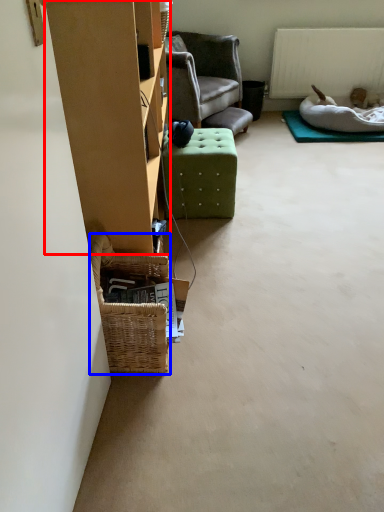
Question: Among these objects, which one is farthest to the camera, furniture (highlighted by a red box) or picnic basket (highlighted by a blue box)?

Choices:
 (A) furniture
 (B) picnic basket

Answer: (B)